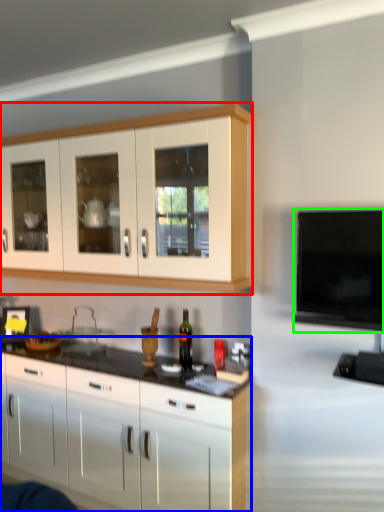
Question: Considering the real-world distances, which object is closest to cabinetry (highlighted by a red box)? cabinetry (highlighted by a blue box) or television (highlighted by a green box).

Choices:
 (A) cabinetry
 (B) television

Answer: (B)